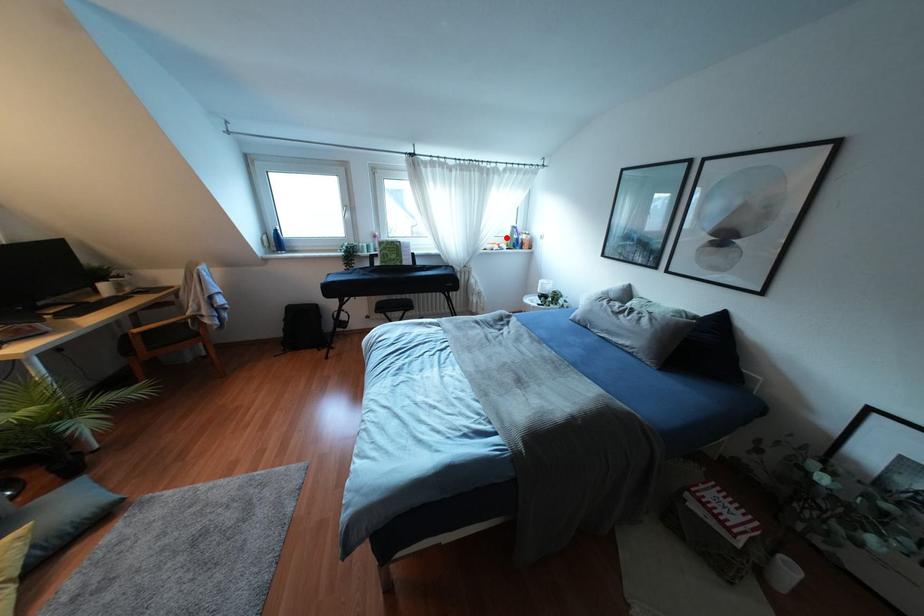
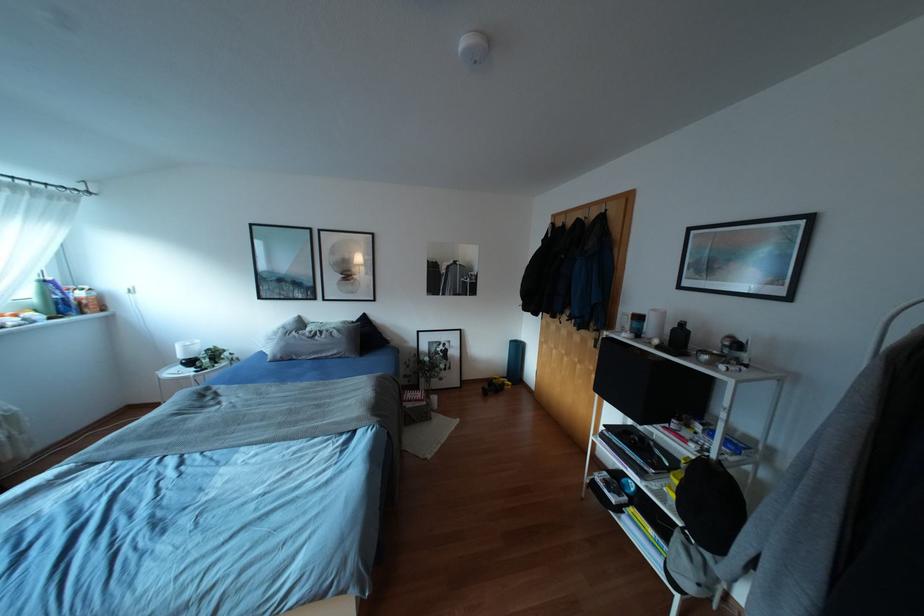
The point at the highlighted location is marked in the first image. Where is the corresponding point in the second image?

(35, 301)